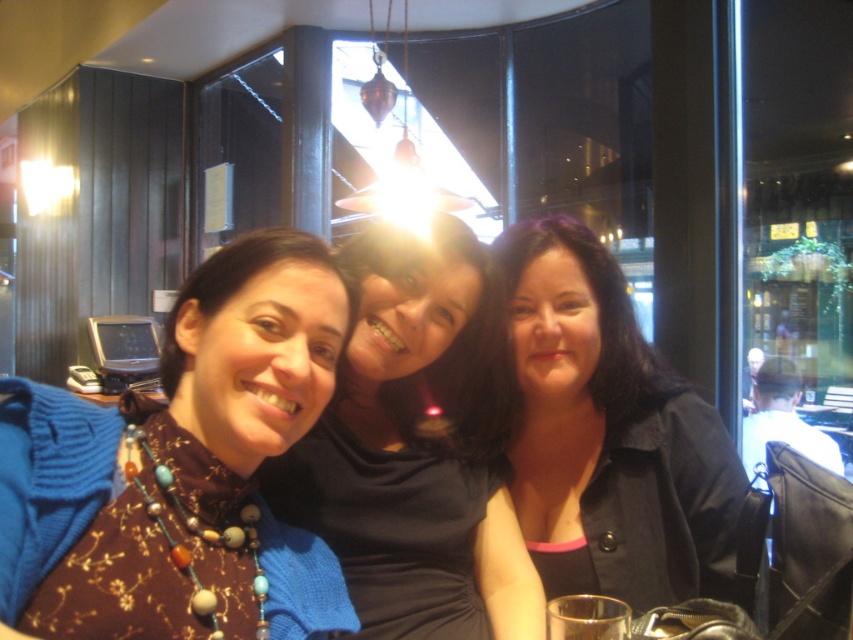
Who is higher up, matte black dress at center or black matte jacket at center?

Positioned higher is black matte jacket at center.

Can you confirm if matte black dress at center is thinner than black matte jacket at center?

Correct, matte black dress at center's width is less than black matte jacket at center's.

Is point (515, 620) farther from viewer compared to point (575, 328)?

No, it is in front of (575, 328).

Find the location of a particular element. This screenshot has width=853, height=640. matte black dress at center is located at coordinates (415, 449).

From the picture: Does brown fabric sweater at center appear over black matte jacket at center?

Yes, brown fabric sweater at center is above black matte jacket at center.

This screenshot has height=640, width=853. Find the location of `brown fabric sweater at center`. brown fabric sweater at center is located at coordinates (247, 364).

You are a GUI agent. You are given a task and a screenshot of the screen. Output one action in this format:
    pyautogui.click(x=<x>, y=<y>)
    Task: Click on the brown fabric sweater at center
    This screenshot has height=640, width=853.
    Given the screenshot: What is the action you would take?
    click(247, 364)

Does brown fabric sweater at center appear on the left side of matte black dress at center?

Indeed, brown fabric sweater at center is positioned on the left side of matte black dress at center.

The width and height of the screenshot is (853, 640). What are the coordinates of `brown fabric sweater at center` in the screenshot? It's located at (247, 364).